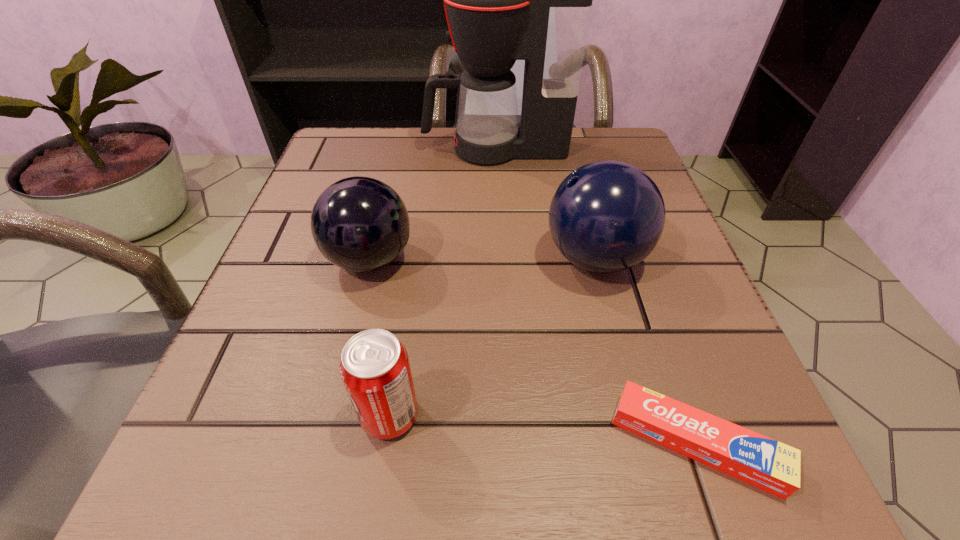
Find the location of a particular element. This screenshot has height=540, width=960. bowling ball located at the right edge is located at coordinates (607, 216).

Where is `toothpaste that is positioned at the right edge`? toothpaste that is positioned at the right edge is located at coordinates (772, 466).

The width and height of the screenshot is (960, 540). I want to click on object located at the far right corner, so pos(505,0).

The width and height of the screenshot is (960, 540). Find the location of `object located at the near right corner`. object located at the near right corner is located at coordinates (772, 466).

Where is `free region at the far edge`? The width and height of the screenshot is (960, 540). free region at the far edge is located at coordinates (446, 173).

Where is `blank space at the left edge`? blank space at the left edge is located at coordinates (336, 318).

I want to click on vacant space at the right edge, so click(x=726, y=368).

The image size is (960, 540). In order to click on vacant space at the far left corner of the desktop in this screenshot , I will do `click(348, 150)`.

Where is `vacant area at the far right corner of the desktop`? The height and width of the screenshot is (540, 960). vacant area at the far right corner of the desktop is located at coordinates (597, 132).

Locate an element on the screen. vacant space at the near right corner of the desktop is located at coordinates (634, 454).